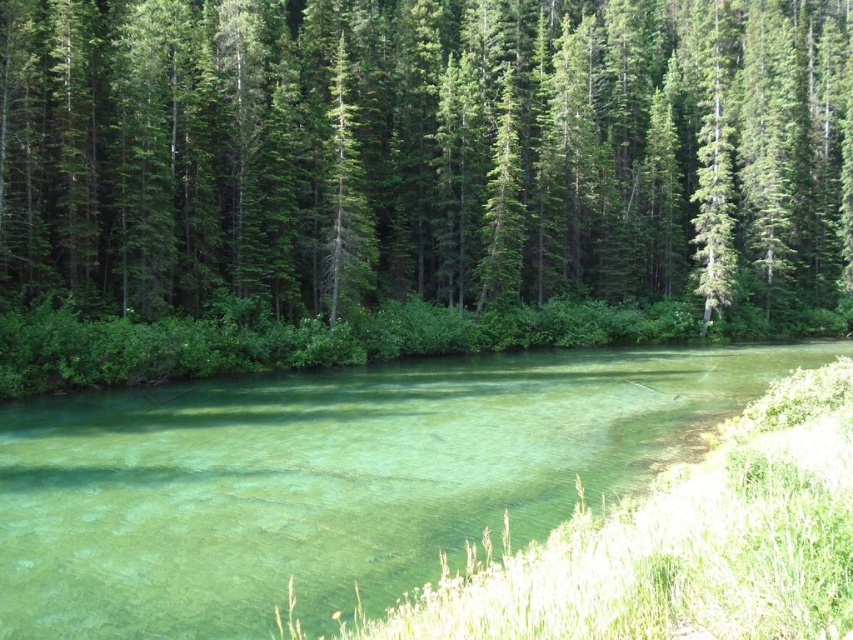
Question: Is green textured trees at upper center bigger than clear glassy water at center?

Choices:
 (A) no
 (B) yes

Answer: (B)

Question: Which of the following is the farthest from the observer?

Choices:
 (A) (502, 513)
 (B) (167, 304)

Answer: (B)

Question: Which point is closer to the camera?

Choices:
 (A) (740, 195)
 (B) (50, 436)

Answer: (B)

Question: Does green textured trees at upper center appear under clear glassy water at center?

Choices:
 (A) yes
 (B) no

Answer: (B)

Question: Is green textured trees at upper center further to the viewer compared to clear glassy water at center?

Choices:
 (A) no
 (B) yes

Answer: (B)